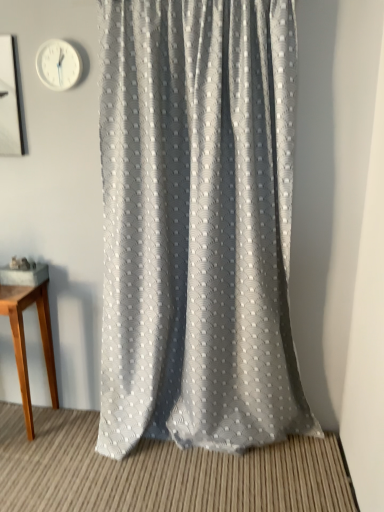
Where is `vacant area situated below light brown wooden table at left (from a real-world perspective)`? vacant area situated below light brown wooden table at left (from a real-world perspective) is located at coordinates (18, 423).